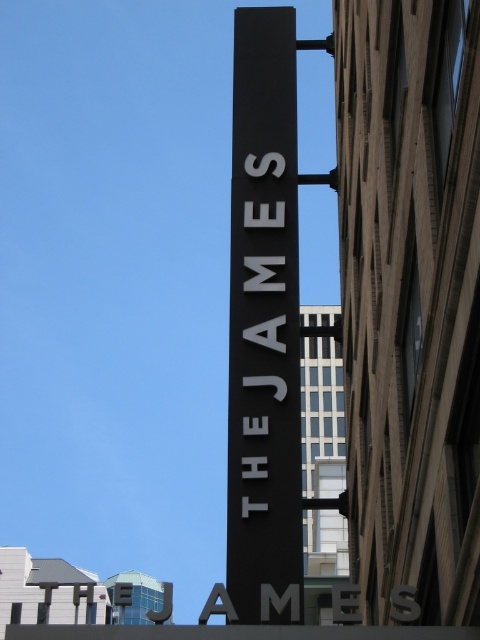
Who is positioned more to the right, black matte sign at center or white matte sign at center?

Positioned to the right is black matte sign at center.

Is black matte sign at center smaller than white matte sign at center?

Actually, black matte sign at center might be larger than white matte sign at center.

This screenshot has height=640, width=480. Identify the location of black matte sign at center. (264, 324).